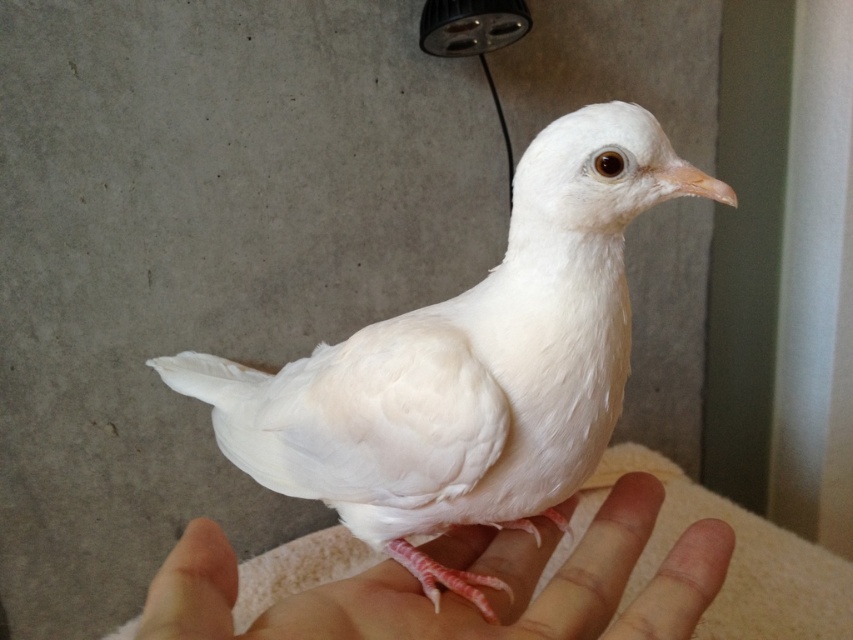
You are a photographer trying to capture a closeup of the white feathered bird at center and the pink flesh at center. Which object should you focus on first to ensure it appears sharp in the photo?

The white feathered bird at center is further to the viewer than the pink flesh at center, so you should focus on the white feathered bird at center first to ensure it appears sharp in the photo.

You are standing in front of the scene and want to touch both the points mentioned. Which point should you reach for first, point (289, 381) or point (682, 557)?

You should reach for point (289, 381) first because it is closer to you than point (682, 557).

You are a photographer standing 24 inches away from a white feathered bird at center. Can you capture the bird in focus without moving closer?

The white feathered bird at center is 20.86 inches away from the camera. Since you are standing 24 inches away, you are 3.14 inches further away than the bird. To ensure the bird is in focus, you may need to adjust your focus settings or move slightly closer to within 20.86 inches.